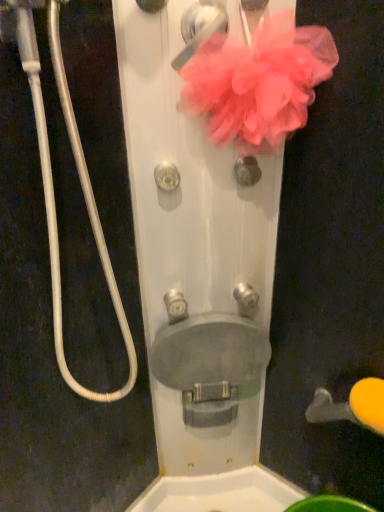
Question: From the image's perspective, is pink fabric door handle at upper center, the 2th door handle in the right-to-left sequence, positioned above or below metallic silver knob at center, placed as the second knob when sorted from top to bottom?

Choices:
 (A) below
 (B) above

Answer: (B)

Question: Relative to metallic silver knob at center, which is the 1th knob in left-to-right order, is pink fabric door handle at upper center, the second door handle from the back, in front or behind?

Choices:
 (A) front
 (B) behind

Answer: (A)

Question: Which is nearer to the pink mesh flower at upper center?

Choices:
 (A) metallic silver knob at center, placed as the second knob when sorted from top to bottom
 (B) pink fabric door handle at upper center, which appears as the first door handle when viewed from the left
 (C) yellow rubber door handle at lower right, positioned as the first door handle in back-to-front order
 (D) satin silver knob at center, the 4th knob from the left
 (E) metallic silver knob at center, which is counted as the 1th knob, starting from the bottom

Answer: (B)

Question: Based on their relative distances, which object is nearer to the satin silver knob at center, the 4th knob from the left?

Choices:
 (A) metallic silver knob at center, which is the 1th knob in left-to-right order
 (B) pink fabric door handle at upper center, which appears as the first door handle when viewed from the left
 (C) pink mesh flower at upper center
 (D) metallic knob at center, which is the 1th knob in top-to-bottom order
 (E) yellow rubber door handle at lower right, arranged as the 1th door handle when ordered from the bottom

Answer: (D)